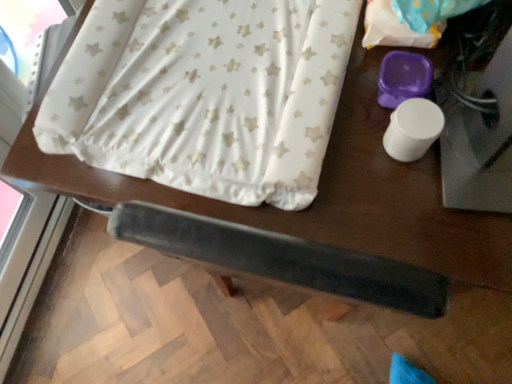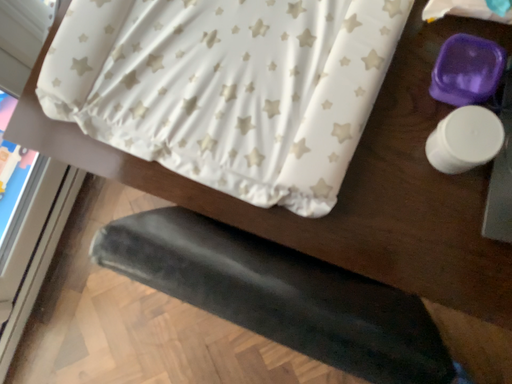
Question: How did the camera likely rotate when shooting the video?

Choices:
 (A) rotated right
 (B) rotated left

Answer: (B)